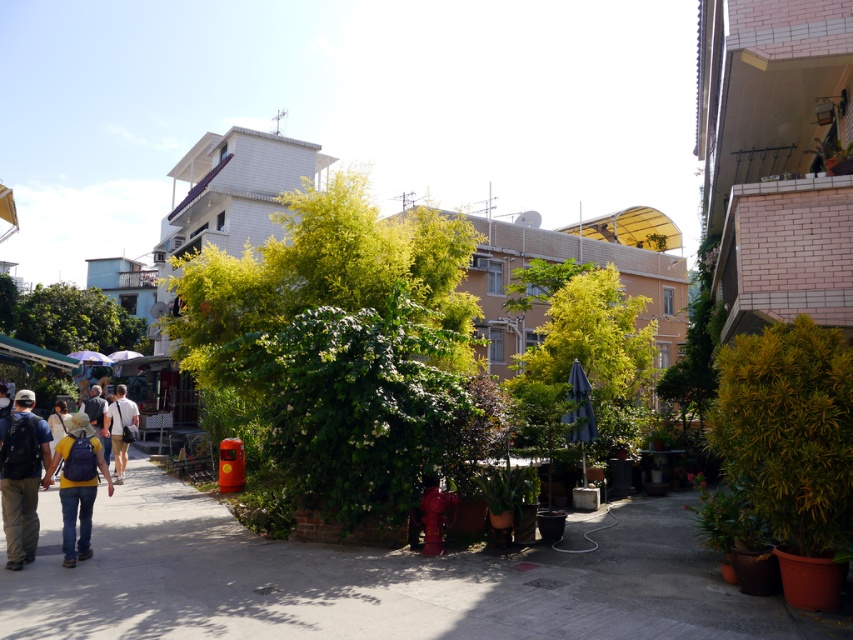
Is point (155, 500) positioned in front of point (7, 540)?

No, (155, 500) is behind (7, 540).

Is gray concrete pavement at center closer to camera compared to dark blue backpack at left?

Yes, gray concrete pavement at center is in front of dark blue backpack at left.

Image resolution: width=853 pixels, height=640 pixels. Describe the element at coordinates (373, 580) in the screenshot. I see `gray concrete pavement at center` at that location.

The image size is (853, 640). Identify the location of gray concrete pavement at center. (373, 580).

The width and height of the screenshot is (853, 640). What do you see at coordinates (21, 476) in the screenshot? I see `dark blue backpack at left` at bounding box center [21, 476].

Does dark blue backpack at left have a smaller size compared to light brown backpack at center?

Yes, dark blue backpack at left is smaller than light brown backpack at center.

Between point (38, 433) and point (119, 413), which one is positioned behind?

The point (119, 413) is more distant.

Locate an element on the screen. This screenshot has width=853, height=640. dark blue backpack at left is located at coordinates (21, 476).

Looking at this image, which of these two, blue fabric umbrella at center or light brown backpack at center-left, stands taller?

Standing taller between the two is light brown backpack at center-left.

Does blue fabric umbrella at center appear on the left side of light brown backpack at center-left?

Incorrect, blue fabric umbrella at center is not on the left side of light brown backpack at center-left.

At what (x,y) coordinates should I click in order to perform the action: click on blue fabric umbrella at center. Please return your answer as a coordinate pair (x, y). The width and height of the screenshot is (853, 640). Looking at the image, I should click on (579, 412).

I want to click on blue fabric umbrella at center, so click(x=579, y=412).